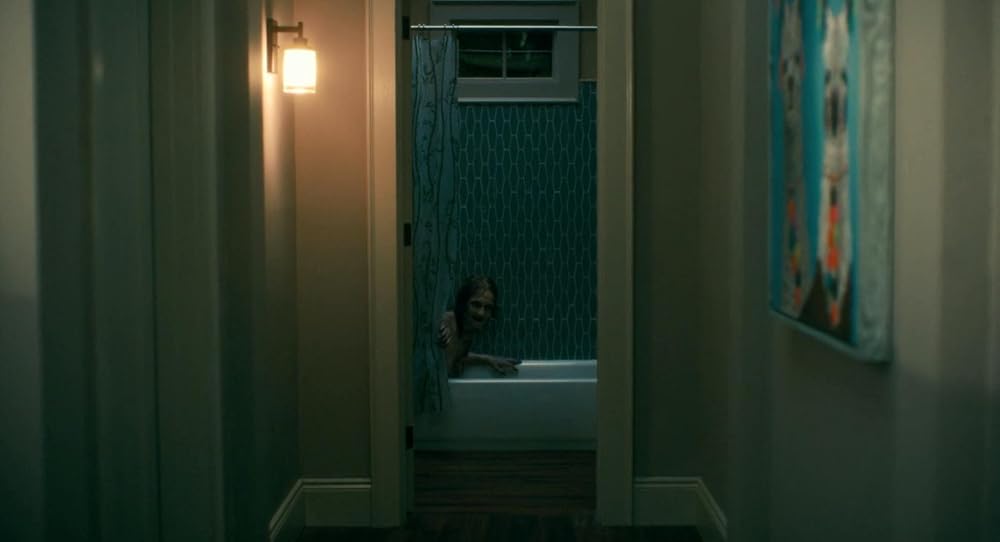
The height and width of the screenshot is (542, 1000). I want to click on darkened room, so click(737, 220).